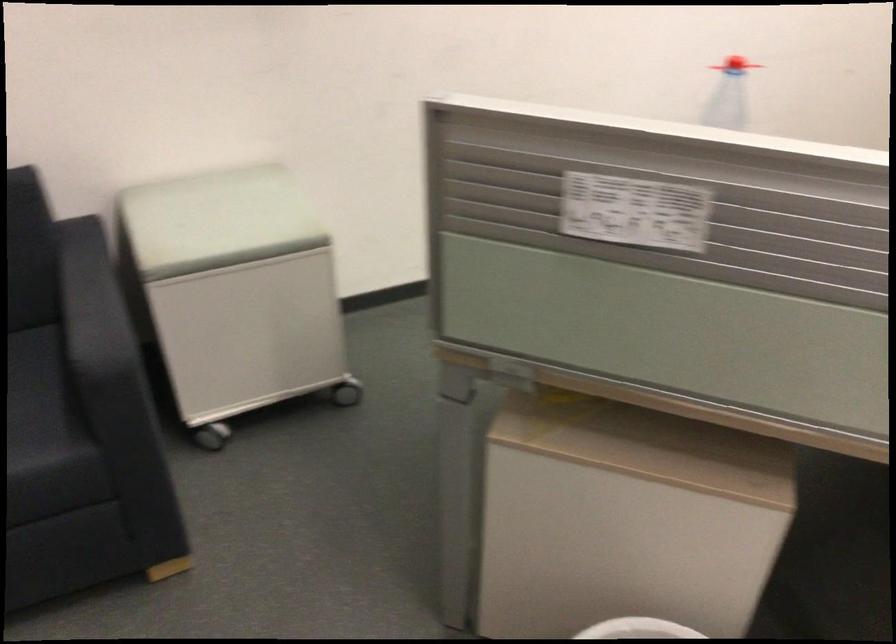
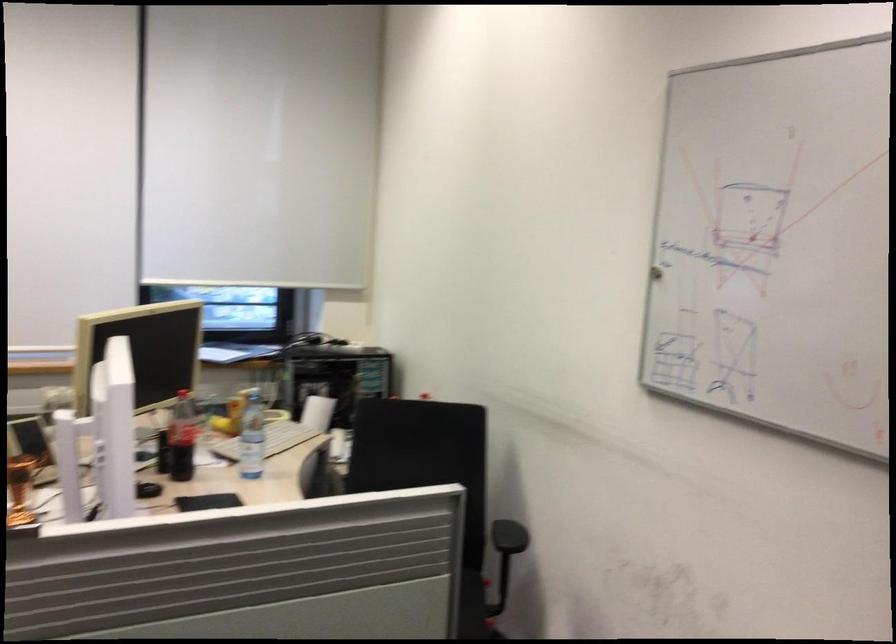
Question: Based on the continuous images, in which direction is the camera rotating? Reply with the corresponding letter.

Choices:
 (A) Left
 (B) Right
 (C) Up
 (D) Down

Answer: (B)